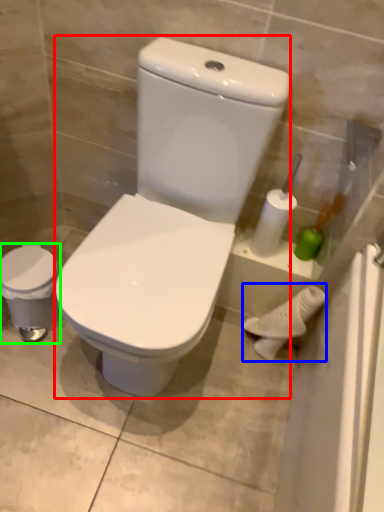
Question: Which object is the farthest from porcelain (highlighted by a red box)? Choose among these: porcelain (highlighted by a blue box) or porcelain (highlighted by a green box).

Choices:
 (A) porcelain
 (B) porcelain

Answer: (A)